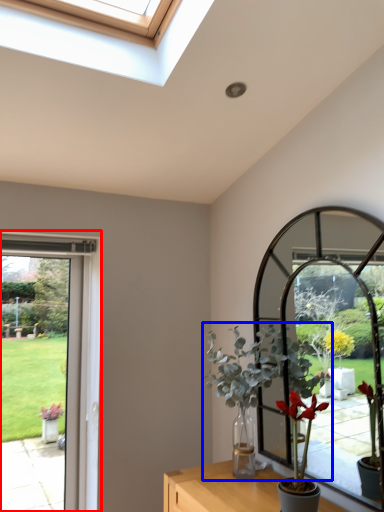
Question: Which object appears closest to the camera in this image, window frame (highlighted by a red box) or houseplant (highlighted by a blue box)?

Choices:
 (A) window frame
 (B) houseplant

Answer: (B)